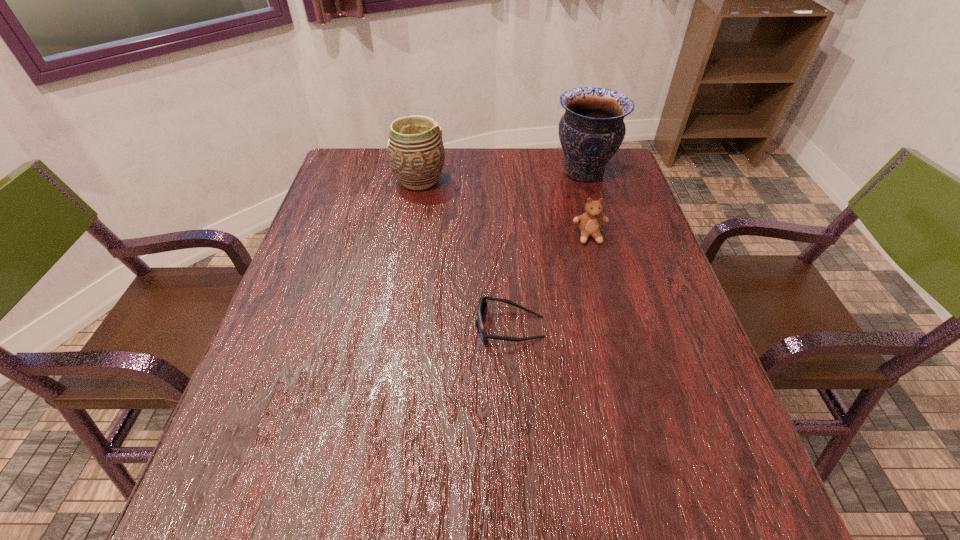
Locate an element on the screen. This screenshot has width=960, height=540. the right pottery is located at coordinates (592, 129).

Find the location of a particular element. the tallest object is located at coordinates (592, 129).

At what (x,y) coordinates should I click in order to perform the action: click on the left pottery. Please return your answer as a coordinate pair (x, y). The width and height of the screenshot is (960, 540). Looking at the image, I should click on (415, 151).

At what (x,y) coordinates should I click in order to perform the action: click on the second tallest object. Please return your answer as a coordinate pair (x, y). The height and width of the screenshot is (540, 960). Looking at the image, I should click on (415, 151).

Find the location of `teddy bear`. teddy bear is located at coordinates (590, 222).

The width and height of the screenshot is (960, 540). What are the coordinates of `the third tallest object` in the screenshot? It's located at (590, 222).

At what (x,y) coordinates should I click in order to perform the action: click on the third object from right to left. Please return your answer as a coordinate pair (x, y). This screenshot has width=960, height=540. Looking at the image, I should click on (482, 304).

Find the location of a particular element. The height and width of the screenshot is (540, 960). the nearest object is located at coordinates (482, 304).

Where is `free space located on the front handle of the tallest object`? This screenshot has width=960, height=540. free space located on the front handle of the tallest object is located at coordinates (444, 172).

This screenshot has width=960, height=540. What are the coordinates of `free spot located 0.180m on the front handle of the tallest object` in the screenshot? It's located at (492, 172).